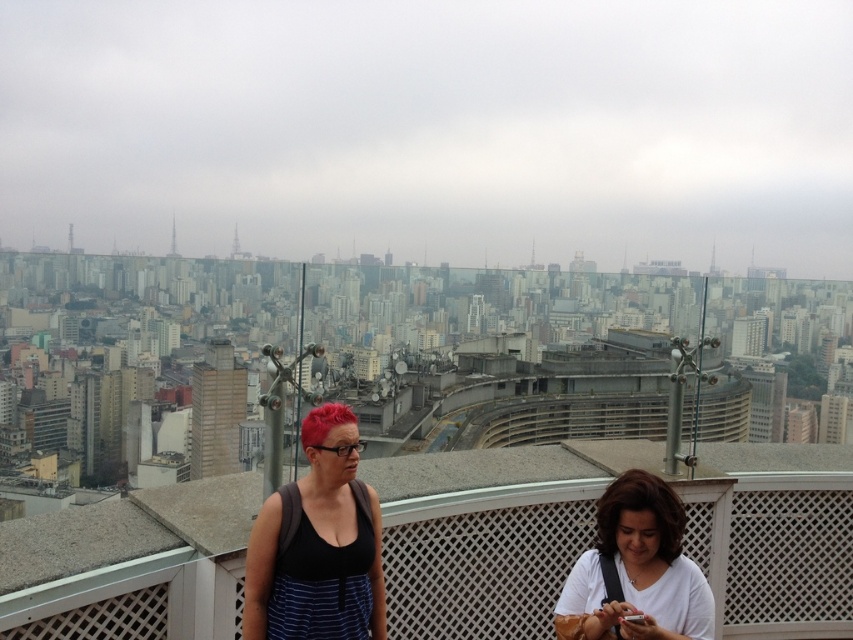
Question: Estimate the real-world distances between objects in this image. Which object is farther from the brown smooth hair at lower center?

Choices:
 (A) white lattice balcony at center
 (B) matte black tank top at center

Answer: (B)

Question: Which object is closer to the camera taking this photo?

Choices:
 (A) white lattice balcony at center
 (B) matte black tank top at center
 (C) brown smooth hair at lower center
 (D) vivid red hair at center

Answer: (A)

Question: Does matte black tank top at center have a smaller size compared to white matte shirt at lower right?

Choices:
 (A) yes
 (B) no

Answer: (A)

Question: Can you confirm if white matte shirt at lower right is positioned to the right of brown smooth hair at lower center?

Choices:
 (A) no
 (B) yes

Answer: (A)

Question: Is the position of white lattice balcony at center more distant than that of matte black tank top at center?

Choices:
 (A) yes
 (B) no

Answer: (B)

Question: Among these objects, which one is farthest from the camera?

Choices:
 (A) brown smooth hair at lower center
 (B) white lattice balcony at center
 (C) white matte shirt at lower right
 (D) matte black tank top at center

Answer: (A)